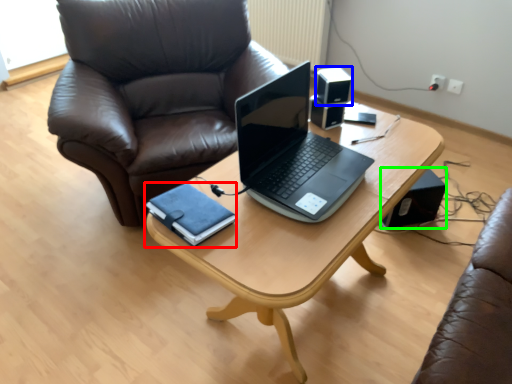
Question: Based on their relative distances, which object is farther from notebook (highlighted by a red box)? Choose from speaker (highlighted by a blue box) and speaker (highlighted by a green box).

Choices:
 (A) speaker
 (B) speaker

Answer: (B)